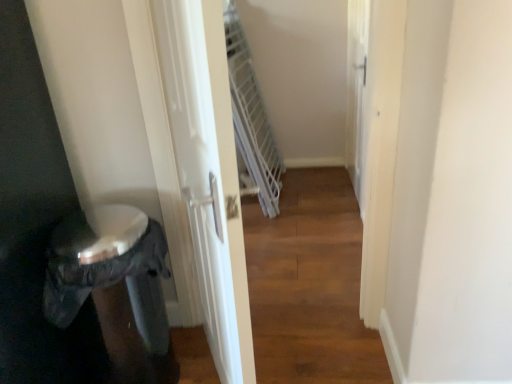
How much space does white glossy screen door at upper right, the second screen door viewed from the left, occupy vertically?

It is 1.12 meters.

The height and width of the screenshot is (384, 512). Identify the location of black plastic potty at lower left. (113, 285).

Could white glossy screen door at center, the second screen door in the back-to-front sequence, be considered to be inside black plastic potty at lower left?

No, white glossy screen door at center, the second screen door in the back-to-front sequence, is not a part of black plastic potty at lower left.

Is white glossy screen door at center, which appears as the first screen door when viewed from the front, at the back of black plastic potty at lower left?

black plastic potty at lower left does not have its back to white glossy screen door at center, which appears as the first screen door when viewed from the front.

Find the location of `potty behind the white glossy screen door at center, the 1th screen door from the left`. potty behind the white glossy screen door at center, the 1th screen door from the left is located at coordinates (113, 285).

Is white glossy screen door at center, which appears as the first screen door when viewed from the front, to the left of black plastic potty at lower left from the viewer's perspective?

No, white glossy screen door at center, which appears as the first screen door when viewed from the front, is not to the left of black plastic potty at lower left.

From a real-world perspective, is white glossy screen door at center, the second screen door in the back-to-front sequence, on black plastic potty at lower left?

Correct, in the physical world, white glossy screen door at center, the second screen door in the back-to-front sequence, is higher than black plastic potty at lower left.

Does white glossy screen door at center, the second screen door in the back-to-front sequence, turn towards black plastic potty at lower left?

Yes, white glossy screen door at center, the second screen door in the back-to-front sequence, is oriented towards black plastic potty at lower left.

Image resolution: width=512 pixels, height=384 pixels. I want to click on potty on the left of white glossy screen door at center, the second screen door in the back-to-front sequence, so click(x=113, y=285).

From a real-world perspective, is white glossy screen door at upper right, which is the second screen door in front-to-back order, positioned above or below white glossy screen door at center, the 1th screen door from the left?

white glossy screen door at upper right, which is the second screen door in front-to-back order, is below white glossy screen door at center, the 1th screen door from the left.

Is white glossy screen door at upper right, which ranks as the 1th screen door in right-to-left order, bigger or smaller than white glossy screen door at center, the 2th screen door viewed from the right?

In the image, white glossy screen door at upper right, which ranks as the 1th screen door in right-to-left order, appears to be larger than white glossy screen door at center, the 2th screen door viewed from the right.

Relative to white glossy screen door at center, the 2th screen door viewed from the right, is white glossy screen door at upper right, the second screen door viewed from the left, in front or behind?

white glossy screen door at upper right, the second screen door viewed from the left, is positioned farther from the viewer than white glossy screen door at center, the 2th screen door viewed from the right.

Considering the points (360, 26) and (227, 273), which point is behind, point (360, 26) or point (227, 273)?

The point (360, 26) is farther.

This screenshot has height=384, width=512. What are the coordinates of `screen door on the right side of white glossy screen door at center, the 1th screen door from the left` in the screenshot? It's located at (356, 86).

Is white glossy screen door at center, the second screen door in the back-to-front sequence, oriented towards white glossy screen door at upper right, the 1th screen door viewed from the back?

No, white glossy screen door at center, the second screen door in the back-to-front sequence, is not oriented towards white glossy screen door at upper right, the 1th screen door viewed from the back.

From the image's perspective, is white glossy screen door at center, the 1th screen door from the left, over white glossy screen door at upper right, which is the second screen door in front-to-back order?

No, from the image's perspective, white glossy screen door at center, the 1th screen door from the left, is not on top of white glossy screen door at upper right, which is the second screen door in front-to-back order.

Does black plastic potty at lower left have a smaller size compared to white glossy screen door at upper right, which is the second screen door in front-to-back order?

Actually, black plastic potty at lower left might be larger than white glossy screen door at upper right, which is the second screen door in front-to-back order.

From the image's perspective, is black plastic potty at lower left positioned above or below white glossy screen door at upper right, which is the second screen door in front-to-back order?

black plastic potty at lower left is situated lower than white glossy screen door at upper right, which is the second screen door in front-to-back order, in the image.

Is white glossy screen door at upper right, which is the second screen door in front-to-back order, at the back of black plastic potty at lower left?

No, black plastic potty at lower left is not facing the opposite direction of white glossy screen door at upper right, which is the second screen door in front-to-back order.

At what (x,y) coordinates should I click in order to perform the action: click on potty to the left of white glossy screen door at upper right, the 1th screen door viewed from the back. Please return your answer as a coordinate pair (x, y). This screenshot has height=384, width=512. Looking at the image, I should click on (113, 285).

Does white glossy screen door at upper right, which ranks as the 1th screen door in right-to-left order, come behind black plastic potty at lower left?

Yes.

From a real-world perspective, count 1st screen doors upward from the black plastic potty at lower left and point to it. Please provide its 2D coordinates.

[(356, 86)]

Based on the photo, can you confirm if white glossy screen door at upper right, which is the second screen door in front-to-back order, is shorter than black plastic potty at lower left?

Incorrect, the height of white glossy screen door at upper right, which is the second screen door in front-to-back order, does not fall short of that of black plastic potty at lower left.

Is black plastic potty at lower left at the back of white glossy screen door at upper right, which ranks as the 1th screen door in right-to-left order?

No.

The image size is (512, 384). Find the location of `screen door that is the 2nd one above the black plastic potty at lower left (from a real-world perspective)`. screen door that is the 2nd one above the black plastic potty at lower left (from a real-world perspective) is located at coordinates (208, 172).

You are a GUI agent. You are given a task and a screenshot of the screen. Output one action in this format:
    pyautogui.click(x=<x>, y=<y>)
    Task: Click on the potty located below the white glossy screen door at center, the second screen door in the back-to-front sequence (from the image's perspective)
    The width and height of the screenshot is (512, 384).
    Given the screenshot: What is the action you would take?
    pyautogui.click(x=113, y=285)

When comparing their distances from white glossy screen door at upper right, which ranks as the 1th screen door in right-to-left order, does black plastic potty at lower left or white glossy screen door at center, the second screen door in the back-to-front sequence, seem further?

black plastic potty at lower left is positioned further to the anchor white glossy screen door at upper right, which ranks as the 1th screen door in right-to-left order.

Looking at the image, which one is located further to white glossy screen door at upper right, which is the second screen door in front-to-back order, white glossy screen door at center, the 1th screen door from the left, or black plastic potty at lower left?

black plastic potty at lower left.

Considering their positions, is white glossy screen door at center, the 2th screen door viewed from the right, positioned further to black plastic potty at lower left than white glossy screen door at upper right, which is the second screen door in front-to-back order?

white glossy screen door at upper right, which is the second screen door in front-to-back order, is positioned further to the anchor black plastic potty at lower left.

From the picture: Considering their positions, is white glossy screen door at upper right, which ranks as the 1th screen door in right-to-left order, positioned closer to white glossy screen door at center, the 2th screen door viewed from the right, than black plastic potty at lower left?

black plastic potty at lower left is positioned closer to the anchor white glossy screen door at center, the 2th screen door viewed from the right.

Based on their spatial positions, is black plastic potty at lower left or white glossy screen door at upper right, the 1th screen door viewed from the back, closer to white glossy screen door at center, the second screen door in the back-to-front sequence?

The object closer to white glossy screen door at center, the second screen door in the back-to-front sequence, is black plastic potty at lower left.

Estimate the real-world distances between objects in this image. Which object is closer to black plastic potty at lower left, white glossy screen door at upper right, the 1th screen door viewed from the back, or white glossy screen door at center, the 2th screen door viewed from the right?

The object closer to black plastic potty at lower left is white glossy screen door at center, the 2th screen door viewed from the right.

Locate an element on the screen. This screenshot has width=512, height=384. potty between white glossy screen door at center, the 2th screen door viewed from the right, and white glossy screen door at upper right, which ranks as the 1th screen door in right-to-left order, in the front-back direction is located at coordinates (113, 285).